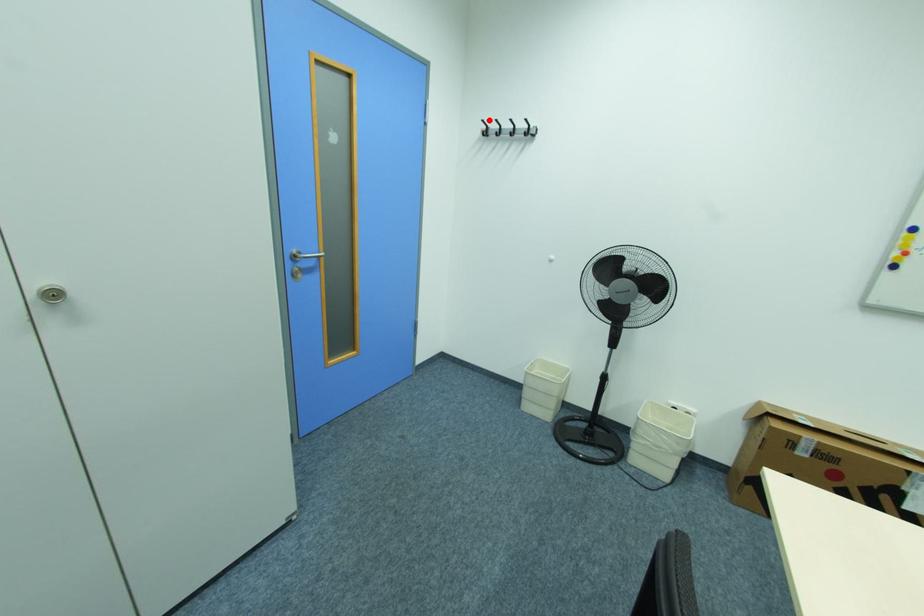
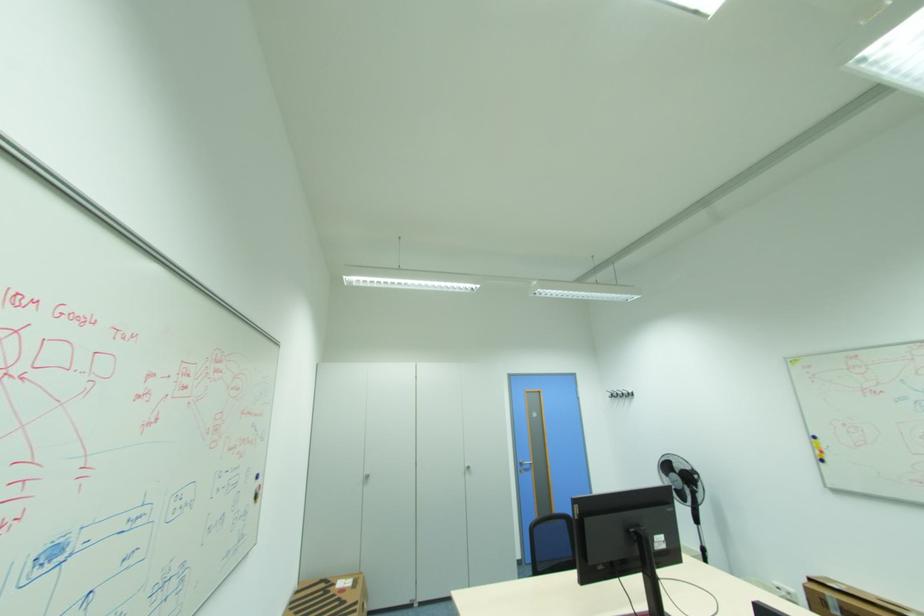
Locate, in the second image, the point that corresponds to the highlighted location in the first image.

(613, 391)